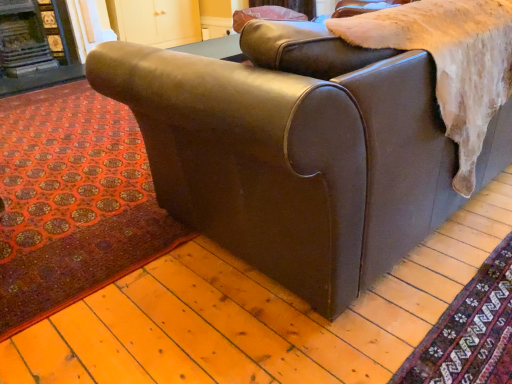
Question: Considering the relative positions of carpeted floor at lower right, which is counted as the 2th mat, starting from the left, and matte pink pillow at upper center in the image provided, is carpeted floor at lower right, which is counted as the 2th mat, starting from the left, to the left or to the right of matte pink pillow at upper center?

Choices:
 (A) right
 (B) left

Answer: (A)

Question: From a real-world perspective, is carpeted floor at lower right, which is counted as the 2th mat, starting from the left, above or below matte pink pillow at upper center?

Choices:
 (A) below
 (B) above

Answer: (A)

Question: Based on their relative distances, which object is nearer to the carpeted floor at lower right, which ranks as the first mat in right-to-left order?

Choices:
 (A) red carpet at lower left, which is counted as the second mat, starting from the front
 (B) matte brown leather couch at center
 (C) matte pink pillow at upper center
 (D) dark brown wood fireplace at upper left

Answer: (B)

Question: Considering the real-world distances, which object is farthest from the carpeted floor at lower right, which is counted as the 2th mat, starting from the left?

Choices:
 (A) matte brown leather couch at center
 (B) dark brown wood fireplace at upper left
 (C) matte pink pillow at upper center
 (D) red carpet at lower left, the second mat from the right

Answer: (B)